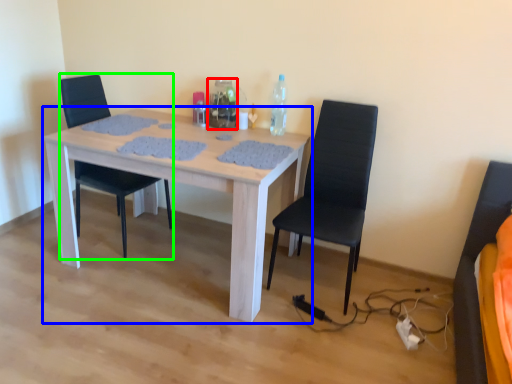
Question: Based on their relative distances, which object is nearer to bottle (highlighted by a red box)? Choose from kitchen & dining room table (highlighted by a blue box) and chair (highlighted by a green box).

Choices:
 (A) kitchen & dining room table
 (B) chair

Answer: (A)